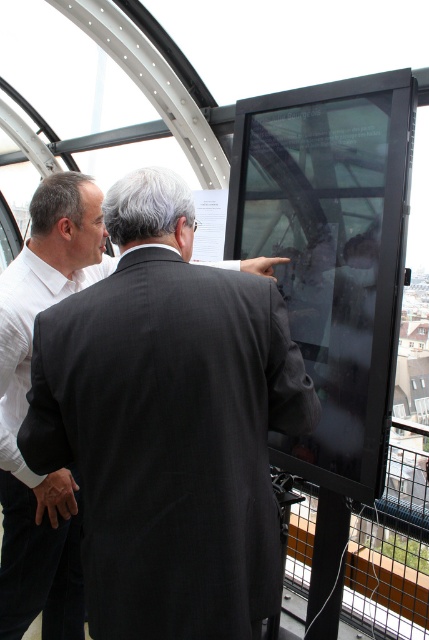
Consider the image. You are designing a seating arrangement for a meeting in this room. The black wool suit at center and the white shirt at left need to be seated such that they have equal space. Given their current spatial occupation, what adjustment should be made?

The black wool suit at center currently occupies less space than the white shirt at left. To equalize their space, the black wool suit at center should be moved to a larger area or the white shirt at left should be moved to a smaller area so both have the same amount of space.